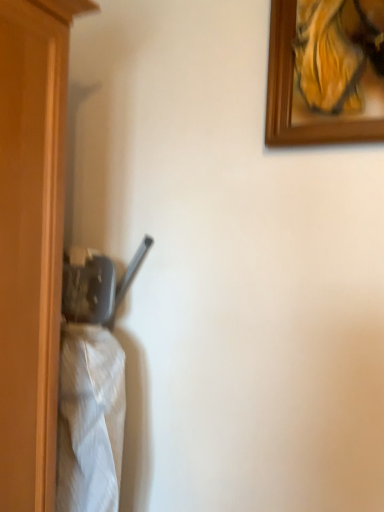
What do you see at coordinates (92, 388) in the screenshot?
I see `white fabric laundry at left` at bounding box center [92, 388].

Where is `white fabric laundry at left`? white fabric laundry at left is located at coordinates (92, 388).

Measure the distance between white fabric laundry at left and camera.

They are 1.04 meters apart.

Locate an element on the screen. The image size is (384, 512). white fabric laundry at left is located at coordinates (92, 388).